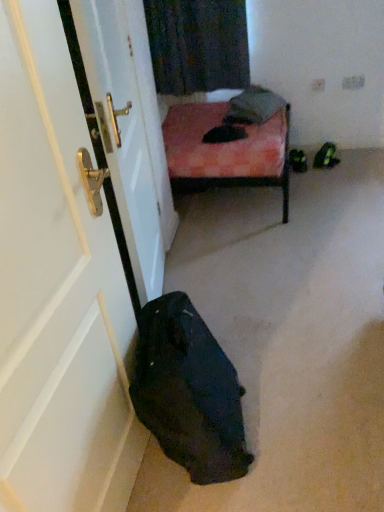
Find the location of a particular element. velvet pink cushion at upper center is located at coordinates (253, 106).

The image size is (384, 512). What do you see at coordinates (253, 106) in the screenshot?
I see `velvet pink cushion at upper center` at bounding box center [253, 106].

Locate an element on the screen. This screenshot has width=384, height=512. matte white door at left is located at coordinates (57, 290).

Describe the element at coordinates (57, 290) in the screenshot. I see `matte white door at left` at that location.

Locate an element on the screen. velvet pink cushion at upper center is located at coordinates (253, 106).

In the image, is matte white door at left on the left side or the right side of velvet pink cushion at upper center?

In the image, matte white door at left appears on the left side of velvet pink cushion at upper center.

Looking at this image, is matte white door at left positioned before velvet pink cushion at upper center?

Yes, matte white door at left is closer to the camera.

Which is less distant, [23,147] or [273,109]?

The point [23,147] is closer.

From the image's perspective, relative to velvet pink cushion at upper center, is matte white door at left above or below?

matte white door at left is below velvet pink cushion at upper center.

From a real-world perspective, is matte white door at left physically above velvet pink cushion at upper center?

Correct, in the physical world, matte white door at left is higher than velvet pink cushion at upper center.

In terms of width, does matte white door at left look wider or thinner when compared to velvet pink cushion at upper center?

Considering their sizes, matte white door at left looks slimmer than velvet pink cushion at upper center.

Does matte white door at left have a greater height compared to velvet pink cushion at upper center?

Yes, matte white door at left is taller than velvet pink cushion at upper center.

In terms of size, does matte white door at left appear bigger or smaller than velvet pink cushion at upper center?

In the image, matte white door at left appears to be larger than velvet pink cushion at upper center.

Would you say matte white door at left contains velvet pink cushion at upper center?

That's incorrect, velvet pink cushion at upper center is not inside matte white door at left.

Would you say matte white door at left is a long distance from velvet pink cushion at upper center?

Indeed, matte white door at left is not near velvet pink cushion at upper center.

Is matte white door at left aimed at velvet pink cushion at upper center?

No, matte white door at left is not oriented towards velvet pink cushion at upper center.

What's the angular difference between matte white door at left and velvet pink cushion at upper center's facing directions?

The angle between the facing direction of matte white door at left and the facing direction of velvet pink cushion at upper center is 21.7 degrees.

What are the coordinates of `pillow above the matte white door at left (from the image's perspective)` in the screenshot? It's located at (253, 106).

Which object is positioned more to the left, velvet pink cushion at upper center or matte white door at left?

matte white door at left.

Consider the image. Which object is more forward, velvet pink cushion at upper center or matte white door at left?

matte white door at left is closer to the camera.

Between point (250, 115) and point (0, 318), which one is positioned in front?

The point (0, 318) is closer to the camera.

From the image's perspective, which object appears higher, velvet pink cushion at upper center or matte white door at left?

velvet pink cushion at upper center appears higher in the image.

From a real-world perspective, who is located higher, velvet pink cushion at upper center or matte white door at left?

In real-world perspective, matte white door at left is above.

Considering the sizes of velvet pink cushion at upper center and matte white door at left in the image, is velvet pink cushion at upper center wider or thinner than matte white door at left?

velvet pink cushion at upper center is wider than matte white door at left.

Who is taller, velvet pink cushion at upper center or matte white door at left?

matte white door at left is taller.

Based on their sizes in the image, would you say velvet pink cushion at upper center is bigger or smaller than matte white door at left?

In the image, velvet pink cushion at upper center appears to be smaller than matte white door at left.

Can matte white door at left be found inside velvet pink cushion at upper center?

Actually, matte white door at left is outside velvet pink cushion at upper center.

Is velvet pink cushion at upper center next to matte white door at left and touching it?

No, velvet pink cushion at upper center is not touching matte white door at left.

Is velvet pink cushion at upper center oriented towards matte white door at left?

No, velvet pink cushion at upper center is not aimed at matte white door at left.

Can you tell me how much velvet pink cushion at upper center and matte white door at left differ in facing direction?

velvet pink cushion at upper center and matte white door at left are facing 21.7 degrees away from each other.

From the picture: How far apart are velvet pink cushion at upper center and matte white door at left?

1.91 meters.

What are the coordinates of `pillow located behind the matte white door at left` in the screenshot? It's located at (253, 106).

Find the location of `pillow on the right side of matte white door at left`. pillow on the right side of matte white door at left is located at coordinates (253, 106).

Locate an element on the screen. This screenshot has width=384, height=512. pillow below the matte white door at left (from a real-world perspective) is located at coordinates (253, 106).